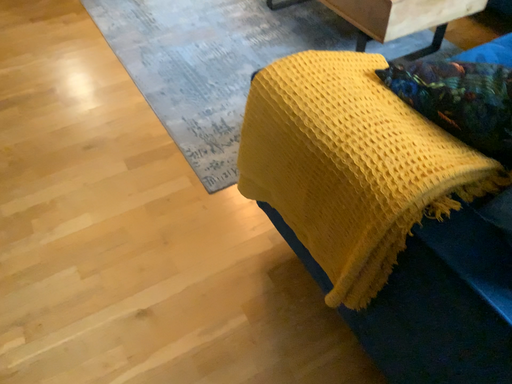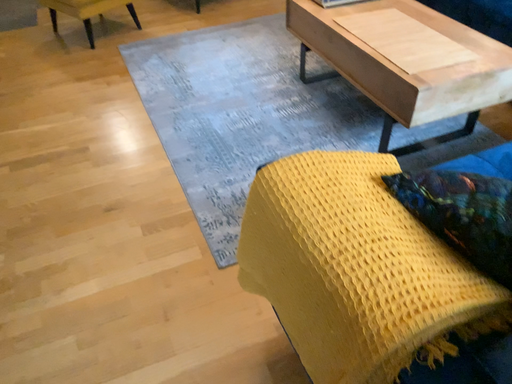
Question: Which way did the camera rotate in the video?

Choices:
 (A) rotated downward
 (B) rotated upward

Answer: (B)